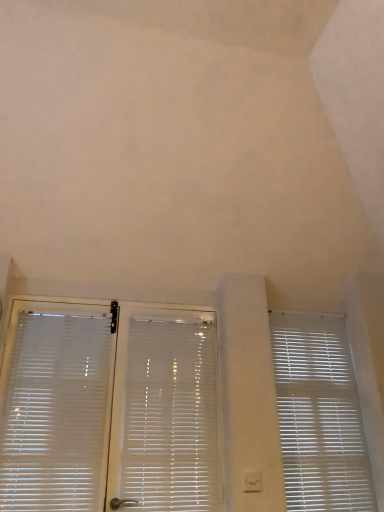
Question: Would you consider white plastic blinds at center, which is the second window blind in right-to-left order, to be distant from white plastic window blind at right, the first window blind from the right?

Choices:
 (A) yes
 (B) no

Answer: (B)

Question: Is white plastic window blind at right, the first window blind from the right, located within white plastic blinds at center, which appears as the second window blind when viewed from the left?

Choices:
 (A) no
 (B) yes

Answer: (A)

Question: Considering the relative sizes of white plastic blinds at center, which appears as the second window blind when viewed from the left, and white plastic window blind at right, the third window blind in the left-to-right sequence, in the image provided, is white plastic blinds at center, which appears as the second window blind when viewed from the left, bigger than white plastic window blind at right, the third window blind in the left-to-right sequence,?

Choices:
 (A) no
 (B) yes

Answer: (B)

Question: From the image's perspective, is white plastic blinds at center, which is the second window blind in right-to-left order, on top of white plastic window blind at right, the first window blind from the right?

Choices:
 (A) no
 (B) yes

Answer: (B)

Question: Is white plastic blinds at center, which is the second window blind in right-to-left order, behind white plastic window blind at right, the first window blind from the right?

Choices:
 (A) yes
 (B) no

Answer: (B)

Question: From the image's perspective, is white plastic window blind at right, the first window blind from the right, positioned above or below white translucent blinds at left, placed as the 3th window blind when sorted from right to left?

Choices:
 (A) above
 (B) below

Answer: (B)

Question: Considering their positions, is white plastic window blind at right, the third window blind in the left-to-right sequence, located in front of or behind white translucent blinds at left, placed as the 1th window blind when sorted from left to right?

Choices:
 (A) front
 (B) behind

Answer: (B)

Question: Is white plastic window blind at right, the first window blind from the right, situated inside white translucent blinds at left, placed as the 3th window blind when sorted from right to left, or outside?

Choices:
 (A) outside
 (B) inside

Answer: (A)

Question: Is point (312, 334) closer or farther from the camera than point (89, 472)?

Choices:
 (A) closer
 (B) farther

Answer: (B)

Question: Considering the positions of white plastic blinds at center, which appears as the second window blind when viewed from the left, and white translucent blinds at left, placed as the 3th window blind when sorted from right to left, in the image, is white plastic blinds at center, which appears as the second window blind when viewed from the left, wider or thinner than white translucent blinds at left, placed as the 3th window blind when sorted from right to left,?

Choices:
 (A) thin
 (B) wide

Answer: (B)

Question: From the image's perspective, relative to white translucent blinds at left, placed as the 1th window blind when sorted from left to right, is white plastic blinds at center, which appears as the second window blind when viewed from the left, above or below?

Choices:
 (A) below
 (B) above

Answer: (A)

Question: Relative to white translucent blinds at left, placed as the 1th window blind when sorted from left to right, is white plastic blinds at center, which appears as the second window blind when viewed from the left, in front or behind?

Choices:
 (A) behind
 (B) front

Answer: (A)

Question: Is white plastic blinds at center, which is the second window blind in right-to-left order, bigger or smaller than white translucent blinds at left, placed as the 1th window blind when sorted from left to right?

Choices:
 (A) small
 (B) big

Answer: (B)

Question: Does point (185, 498) appear closer or farther from the camera than point (344, 368)?

Choices:
 (A) closer
 (B) farther

Answer: (A)

Question: From a real-world perspective, is white plastic blinds at center, which is the second window blind in right-to-left order, physically located above or below white plastic window blind at right, the first window blind from the right?

Choices:
 (A) above
 (B) below

Answer: (B)